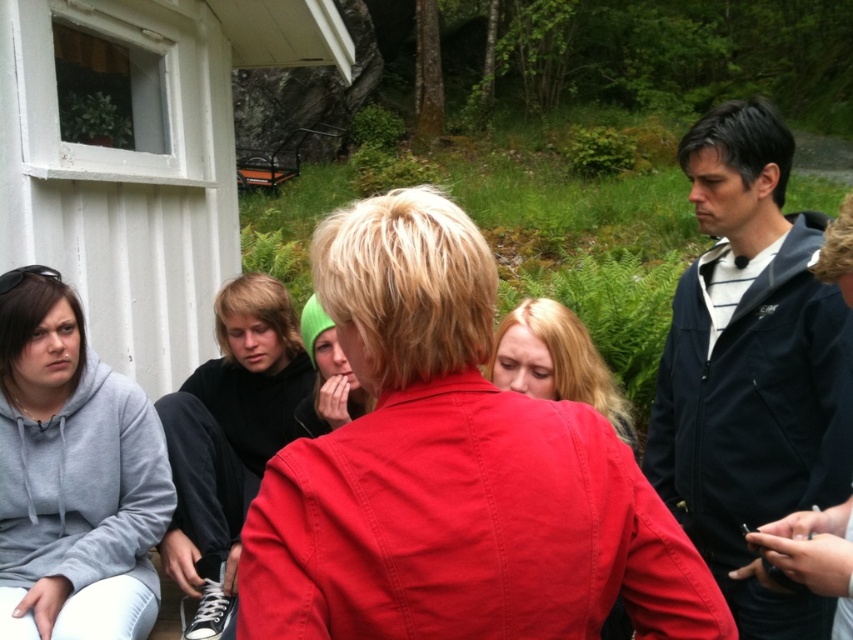
Question: Is dark blue jacket at right to the left of matte red shirt at center from the viewer's perspective?

Choices:
 (A) no
 (B) yes

Answer: (A)

Question: Estimate the real-world distances between objects in this image. Which object is farther from the gray fleece sweatshirt at lower left?

Choices:
 (A) matte red shirt at center
 (B) matte red jacket at center
 (C) green knit hat at center
 (D) black matte jacket at center

Answer: (B)

Question: Among these points, which one is farthest from the camera?

Choices:
 (A) (323, 312)
 (B) (148, 474)
 (C) (337, 573)

Answer: (B)

Question: Can you confirm if dark blue jacket at right is thinner than black matte jacket at center?

Choices:
 (A) no
 (B) yes

Answer: (B)

Question: Which of the following is the closest to the observer?

Choices:
 (A) gray fleece sweatshirt at lower left
 (B) matte red jacket at center
 (C) green knit hat at center
 (D) dark blue jacket at right

Answer: (B)

Question: Can you confirm if gray fleece sweatshirt at lower left is smaller than matte red shirt at center?

Choices:
 (A) yes
 (B) no

Answer: (B)